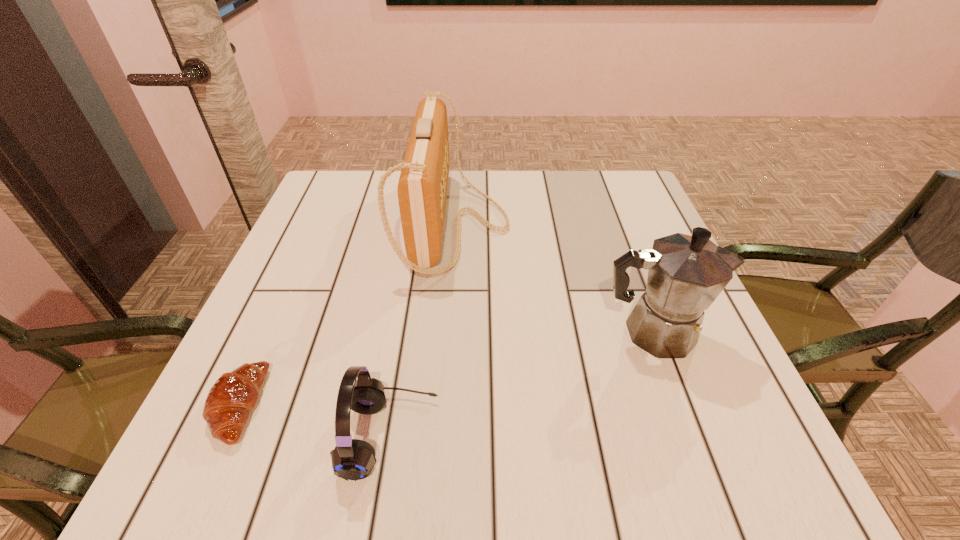
Identify the location of headset that is at the near edge. This screenshot has height=540, width=960. (352, 459).

Find the location of a particular element. crescent roll that is at the near edge is located at coordinates (233, 396).

The height and width of the screenshot is (540, 960). What are the coordinates of `object situated at the left edge` in the screenshot? It's located at (233, 396).

Where is `object that is at the right edge`? The image size is (960, 540). object that is at the right edge is located at coordinates (686, 274).

Identify the location of object present at the near left corner. This screenshot has height=540, width=960. (233, 396).

At what (x,y) coordinates should I click in order to perform the action: click on free location at the near edge. Please return your answer as a coordinate pair (x, y). The width and height of the screenshot is (960, 540). Looking at the image, I should click on (563, 439).

The height and width of the screenshot is (540, 960). I want to click on vacant space at the left edge of the desktop, so [296, 276].

I want to click on vacant region at the right edge of the desktop, so click(653, 385).

At what (x,y) coordinates should I click in order to perform the action: click on vacant space at the far left corner of the desktop. Please return your answer as a coordinate pair (x, y). The image size is (960, 540). Looking at the image, I should click on (307, 209).

Identify the location of free space at the near left corner of the desktop. Image resolution: width=960 pixels, height=540 pixels. (285, 453).